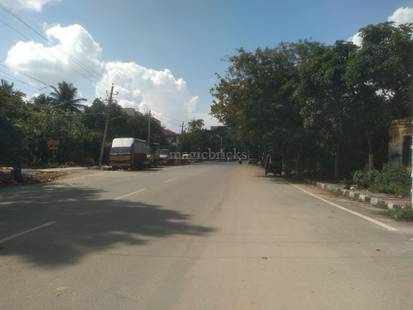
At what (x,y) coordinates should I click in order to perform the action: click on shade. Please return your answer as a coordinate pair (x, y). The image size is (413, 310). Looking at the image, I should click on pyautogui.click(x=110, y=216), pyautogui.click(x=31, y=210).